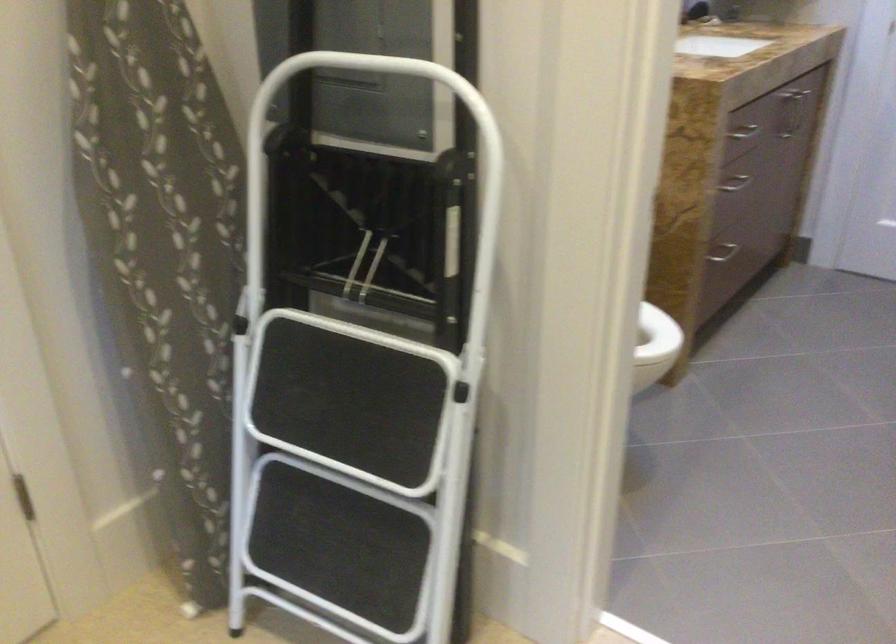
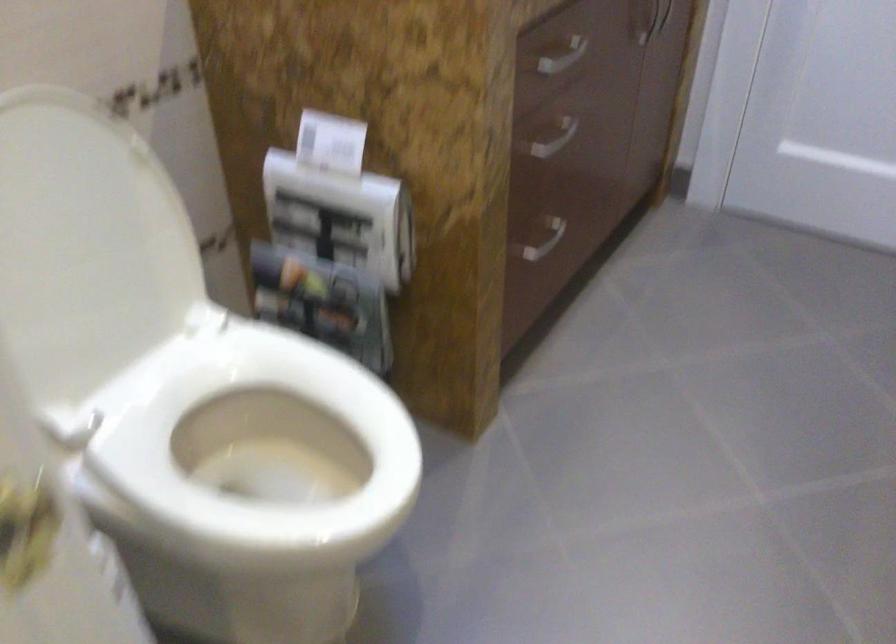
Question: Based on the continuous images, in which direction is the camera rotating? Reply with the corresponding letter.

Choices:
 (A) Left
 (B) Right
 (C) Up
 (D) Down

Answer: (D)